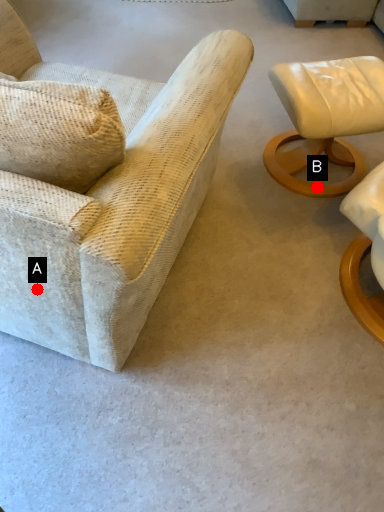
Question: Two points are circled on the image, labeled by A and B beside each circle. Which of the following is the farthest from the observer?

Choices:
 (A) A is further
 (B) B is further

Answer: (B)